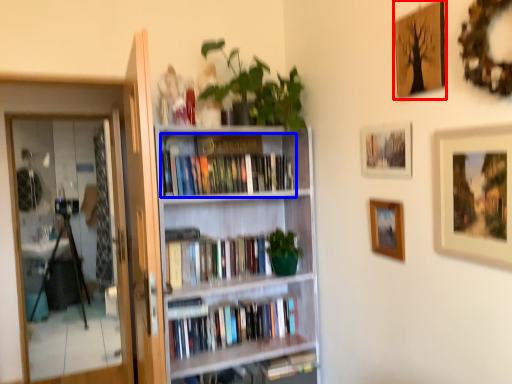
Question: Among these objects, which one is nearest to the camera, picture frame (highlighted by a red box) or book (highlighted by a blue box)?

Choices:
 (A) picture frame
 (B) book

Answer: (A)